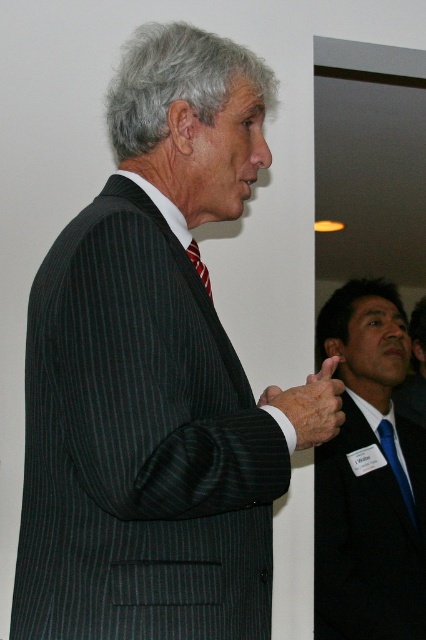
You are a photographer at a formal event. You need to adjust your camera focus to capture both the matte black suit at center and the red striped tie at center. Since the camera can only focus on one plane at a time, which object should you prioritize focusing on to ensure the other remains in acceptable sharpness?

The matte black suit at center is below the red striped tie at center, so focusing on the red striped tie at center would place it closer to the focal plane, potentially keeping the matte black suit at center within the depth of field.

You are a photographer at a business event. You need to capture a photo where the matte black hand at center and the red striped tie at center are both visible. Based on their positions, which one will appear taller in the photo?

The matte black hand at center appears taller in the photo because it has a greater height compared to the red striped tie at center according to the description.